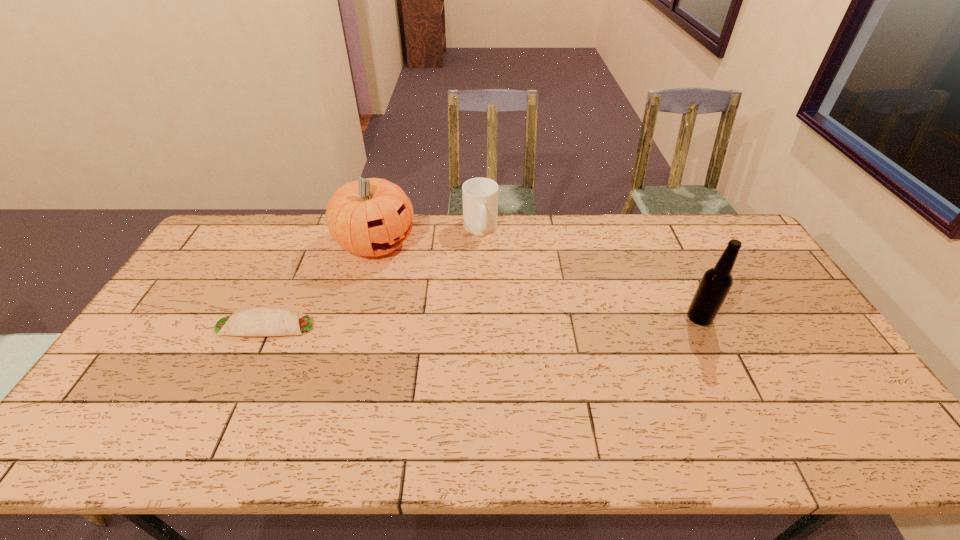
Image resolution: width=960 pixels, height=540 pixels. I want to click on the shortest object, so click(257, 321).

Find the location of a particular element. the rightmost object is located at coordinates (716, 282).

I want to click on pumpkin, so click(x=372, y=217).

Image resolution: width=960 pixels, height=540 pixels. Find the location of `the third object from left to right`. the third object from left to right is located at coordinates tap(480, 195).

Locate an element on the screen. the third tallest object is located at coordinates (480, 195).

Find the location of a particular element. Image resolution: width=960 pixels, height=540 pixels. vacant space located at the bitten end of the shortest object is located at coordinates (446, 326).

Locate an element on the screen. The width and height of the screenshot is (960, 540). vacant position located on the back of the beer bottle is located at coordinates (672, 262).

Where is `vacant space located 0.270m on the front-facing side of the pumpkin`? vacant space located 0.270m on the front-facing side of the pumpkin is located at coordinates (460, 300).

In order to click on blank space located 0.050m on the front-facing side of the pumpkin in this screenshot , I will do `click(412, 267)`.

At what (x,y) coordinates should I click in order to perform the action: click on vacant space located 0.290m on the front-facing side of the pumpkin. Please return your answer as a coordinate pair (x, y). Looking at the image, I should click on (465, 303).